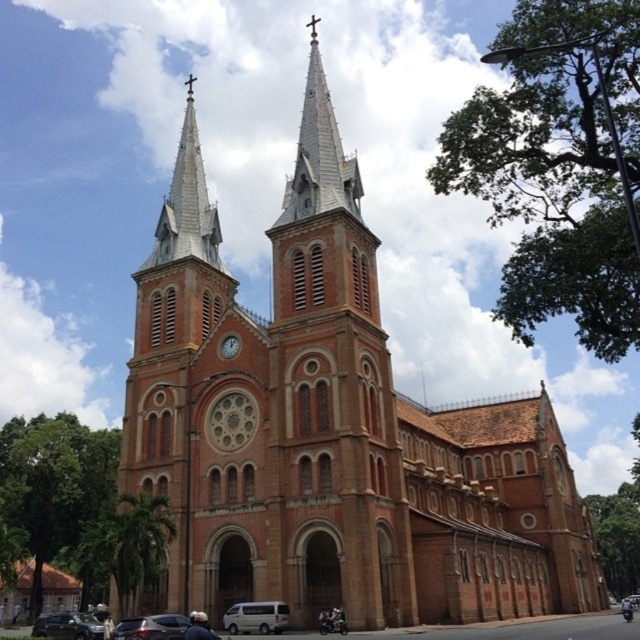
You are standing in front of the historic church and want to determine the relative positions of two points marked on the church structure. The first point is at coordinates point (163, 632) and the second is at point (323, 627). Which point is closer to you?

Point (163, 632) is closer to the viewer than point (323, 627).

You are a photographer planning to take a photo of the historic church with both the black matte motorcycle at lower center and the metallic silver motorcycle at center in the frame. Given their sizes, which motorcycle will appear smaller in the final photo?

The black matte motorcycle at lower center will appear smaller in the final photo because it has a smaller size compared to the metallic silver motorcycle at center.

You are a photographer planning to capture both the black matte motorcycle at lower center and the metallic silver motorcycle at center in a single frame. Given the church and its surroundings, which motorcycle should you position closer to the camera to ensure both fit in the frame without cropping?

Since the black matte motorcycle at lower center is narrower than the metallic silver motorcycle at center, you should position the black matte motorcycle at lower center closer to the camera. This will help maintain their relative sizes in the frame, ensuring both motorcycles fit without cropping.